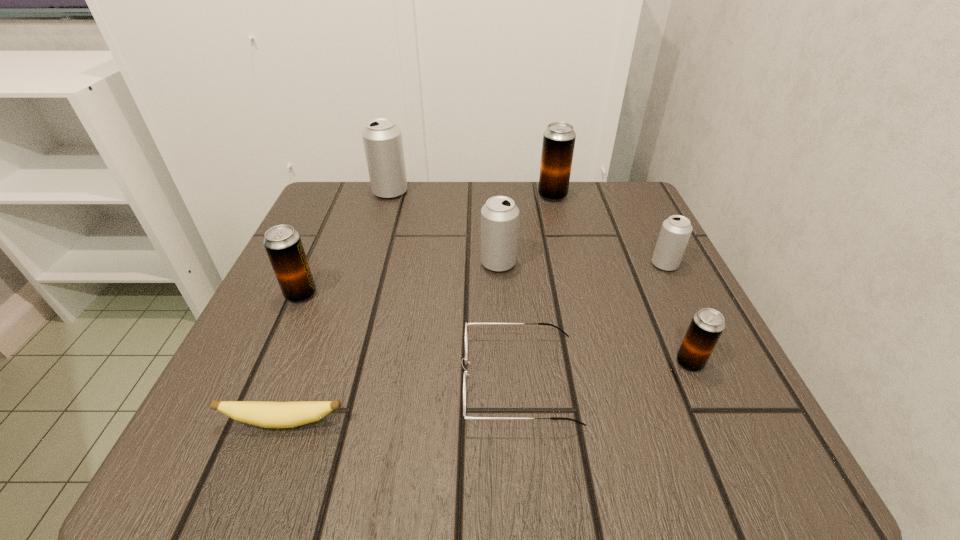
Choose which white beer can is the nearest neighbor to the second white beer can from left to right. Please provide its 2D coordinates. Your answer should be formatted as a tuple, i.e. [(x, y)], where the tuple contains the x and y coordinates of a point satisfying the conditions above.

[(382, 138)]

Point out which white beer can is positioned as the nearest to the smallest white beer can. Please provide its 2D coordinates. Your answer should be formatted as a tuple, i.e. [(x, y)], where the tuple contains the x and y coordinates of a point satisfying the conditions above.

[(499, 216)]

Select which black beer can appears as the closest to the farthest black beer can. Please provide its 2D coordinates. Your answer should be formatted as a tuple, i.e. [(x, y)], where the tuple contains the x and y coordinates of a point satisfying the conditions above.

[(707, 325)]

Locate an element on the screen. The image size is (960, 540). black beer can identified as the second closest to the smallest black beer can is located at coordinates (283, 244).

The height and width of the screenshot is (540, 960). I want to click on free location that satisfies the following two spatial constraints: 1. on the front side of the second farthest black beer can; 2. on the right side of the rightmost black beer can, so click(271, 362).

The height and width of the screenshot is (540, 960). Identify the location of free space that satisfies the following two spatial constraints: 1. on the back side of the second white beer can from left to right; 2. on the left side of the third beer can from right to left. (495, 195).